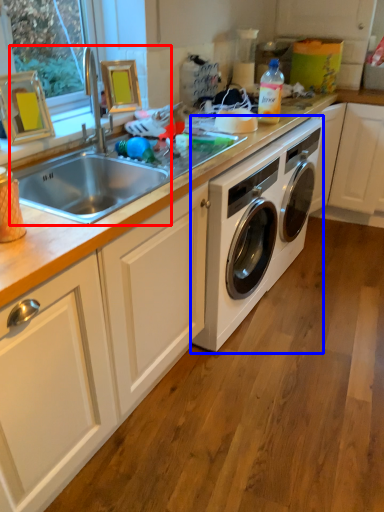
Question: Which object appears farthest to the camera in this image, sink (highlighted by a red box) or washing machine (highlighted by a blue box)?

Choices:
 (A) sink
 (B) washing machine

Answer: (B)